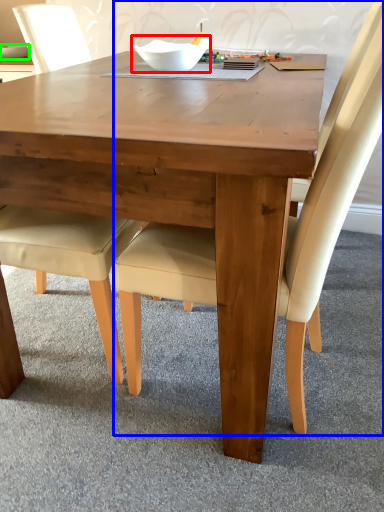
Question: Which object is positioned farthest from bowl (highlighted by a red box)? Select from chair (highlighted by a blue box) and glass bowl (highlighted by a green box).

Choices:
 (A) chair
 (B) glass bowl

Answer: (B)